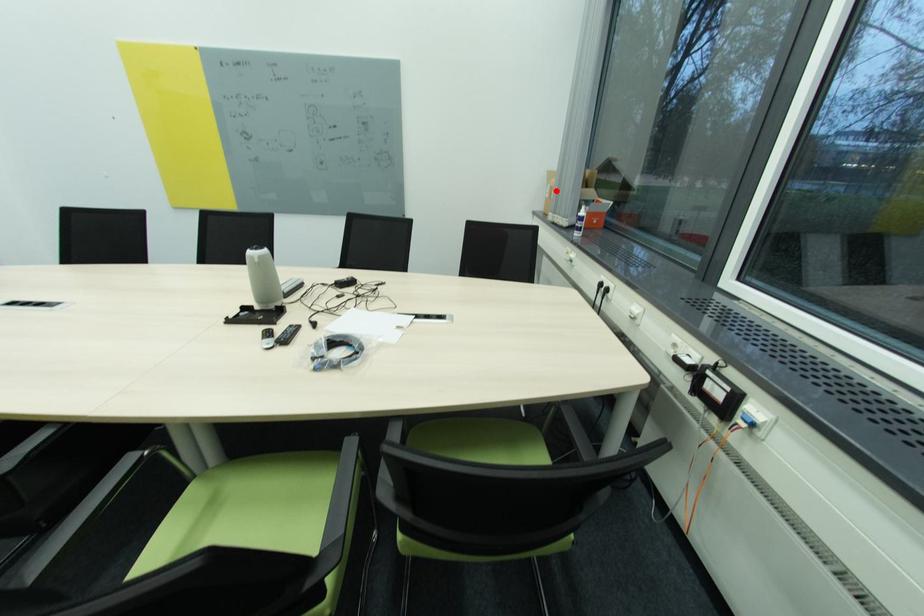
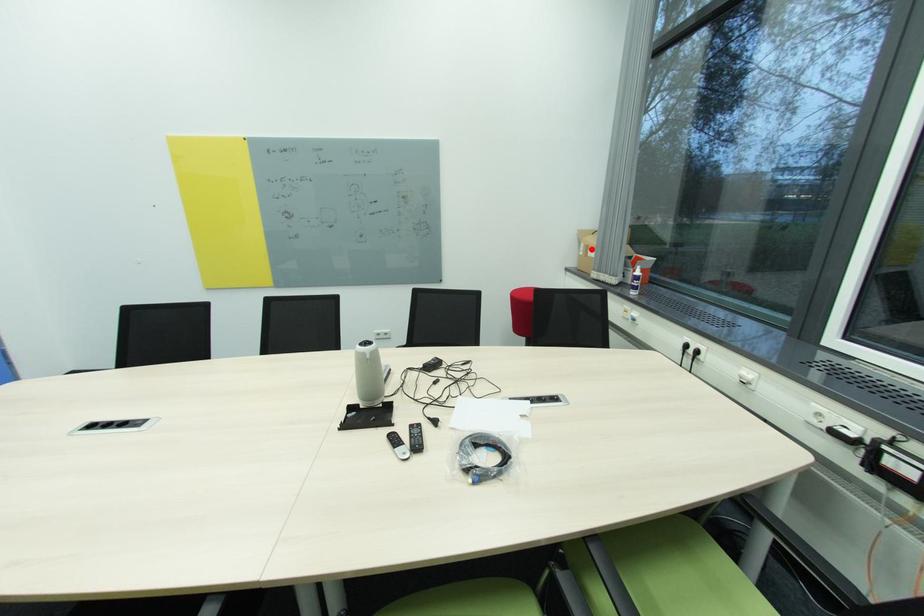
I am providing you with two images of the same scene from different viewpoints. A red point is marked on the first image and another point is marked on the second image. Is the marked point in image1 the same physical position as the marked point in image2?

Yes